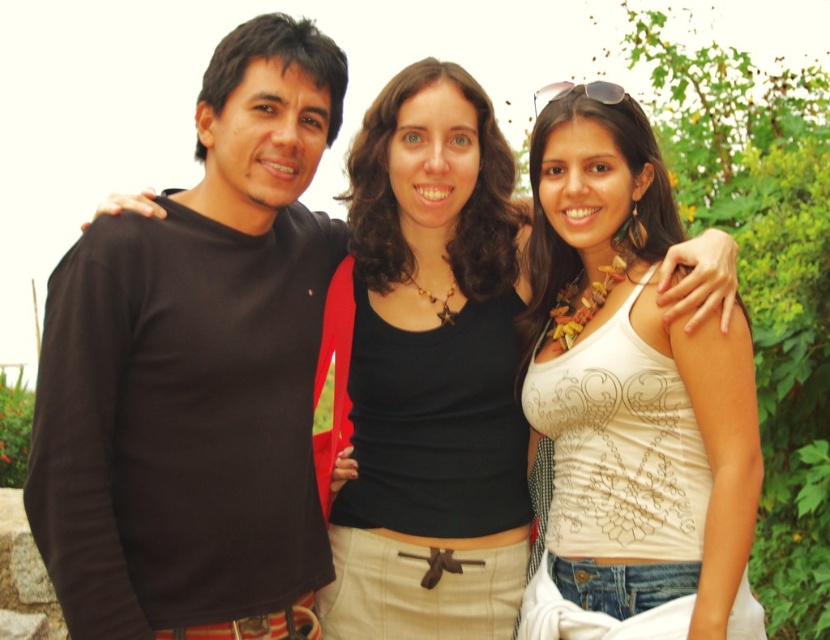
Between black matte shirt at left and white printed tank top at center, which one appears on the left side from the viewer's perspective?

black matte shirt at left

Is point (325, 230) closer to viewer compared to point (583, 512)?

That is False.

Where is `black matte shirt at left`? black matte shirt at left is located at coordinates (196, 369).

Where is `white printed tank top at center`? white printed tank top at center is located at coordinates point(630,397).

Which of these two, white printed tank top at center or black matte tank top at center, stands shorter?

With less height is black matte tank top at center.

Is point (553, 605) less distant than point (482, 301)?

Yes, point (553, 605) is closer to viewer.

I want to click on white printed tank top at center, so click(630, 397).

Between black matte shirt at left and black matte tank top at center, which one appears on the right side from the viewer's perspective?

black matte tank top at center is more to the right.

Can you confirm if black matte shirt at left is bigger than black matte tank top at center?

Yes.

Between point (287, 428) and point (494, 241), which one is positioned behind?

The point (494, 241) is behind.

The height and width of the screenshot is (640, 830). I want to click on black matte shirt at left, so click(196, 369).